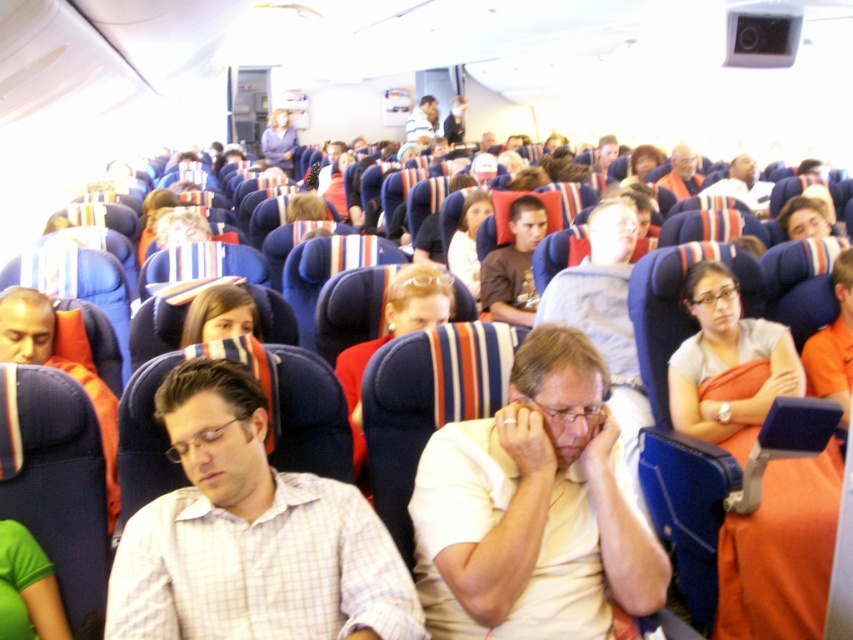
Question: Does matte orange pillow at left appear on the left side of striped shirt at center?

Choices:
 (A) no
 (B) yes

Answer: (B)

Question: Is brown matte shirt at center to the right of striped shirt at center from the viewer's perspective?

Choices:
 (A) no
 (B) yes

Answer: (B)

Question: Which object is farther from the camera taking this photo?

Choices:
 (A) brown matte shirt at center
 (B) matte orange pillow at left
 (C) matte orange shirt at upper right

Answer: (C)

Question: Which point is farther from the camera taking this photo?

Choices:
 (A) (531, 228)
 (B) (9, 320)
 (C) (409, 129)
 (D) (323, 554)

Answer: (C)

Question: Does brown matte shirt at center appear on the right side of matte orange shirt at upper right?

Choices:
 (A) no
 (B) yes

Answer: (A)

Question: Among these objects, which one is farthest from the camera?

Choices:
 (A) striped shirt at center
 (B) matte orange pillow at left
 (C) white matte shirt at center
 (D) matte orange shirt at upper right

Answer: (A)